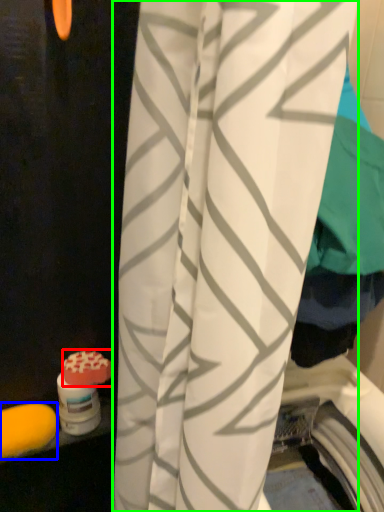
Question: Estimate the real-world distances between objects in this image. Which object is farther from soap (highlighted by a red box), soap (highlighted by a blue box) or curtain (highlighted by a green box)?

Choices:
 (A) soap
 (B) curtain

Answer: (B)